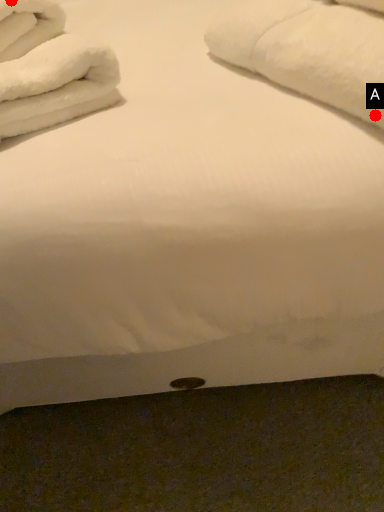
Question: Two points are circled on the image, labeled by A and B beside each circle. Which point is farther from the camera taking this photo?

Choices:
 (A) A is further
 (B) B is further

Answer: (B)